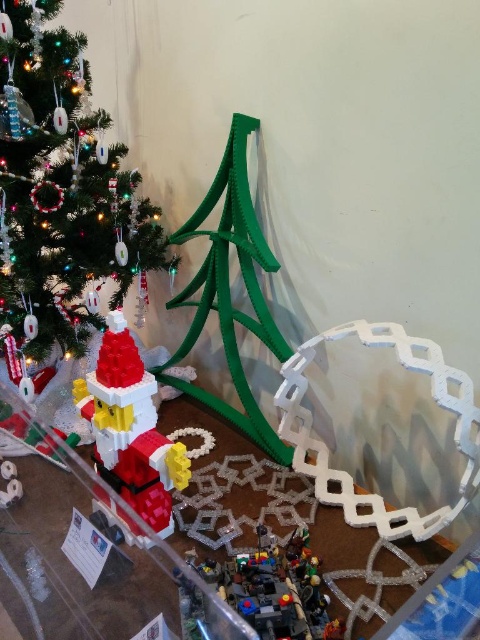
Question: Estimate the real-world distances between objects in this image. Which object is closer to the green matte christmas tree at left?

Choices:
 (A) translucent plastic minifigures at lower center
 (B) matte plastic santa at center

Answer: (B)

Question: Is green matte christmas tree at left bigger than translucent plastic minifigures at lower center?

Choices:
 (A) no
 (B) yes

Answer: (B)

Question: Among these points, which one is nearest to the camera?

Choices:
 (A) (101, 372)
 (B) (68, 262)
 (C) (247, 618)

Answer: (C)

Question: Is green matte christmas tree at left to the right of matte plastic santa at center from the viewer's perspective?

Choices:
 (A) no
 (B) yes

Answer: (A)

Question: Is green matte christmas tree at left bigger than translucent plastic minifigures at lower center?

Choices:
 (A) yes
 (B) no

Answer: (A)

Question: Considering the real-world distances, which object is farthest from the translucent plastic minifigures at lower center?

Choices:
 (A) matte plastic santa at center
 (B) green matte christmas tree at left

Answer: (B)